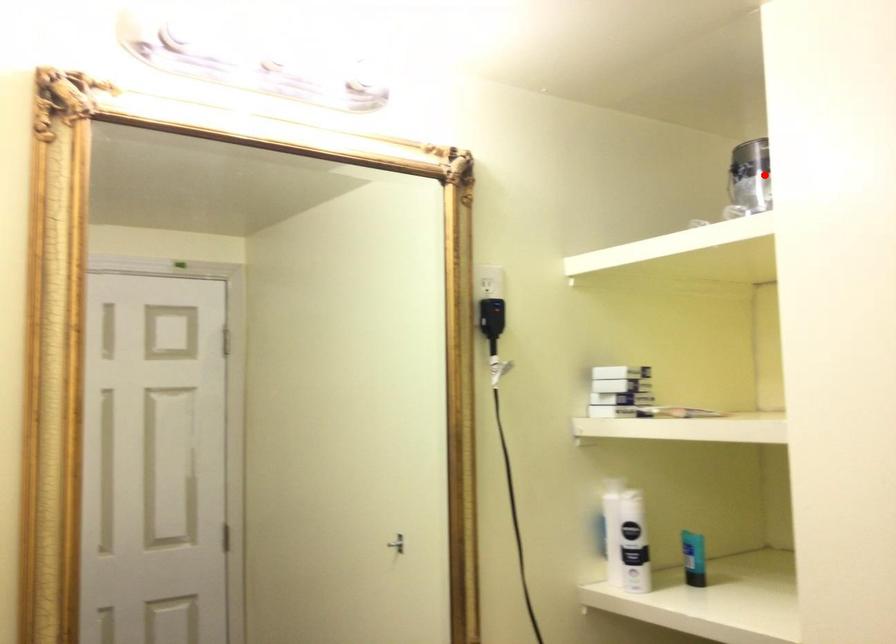
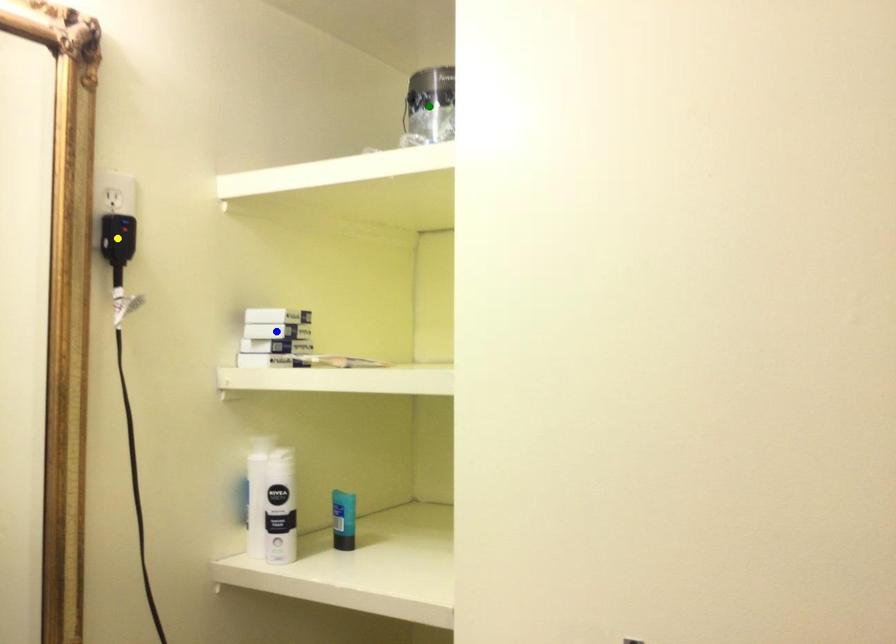
Question: I am providing you with two images of the same scene from different viewpoints. A red point is marked on the first image. You are given multiple points on the second image. Can you choose the point in image 2 that corresponds to the point in image 1?

Choices:
 (A) green point
 (B) yellow point
 (C) blue point

Answer: (A)